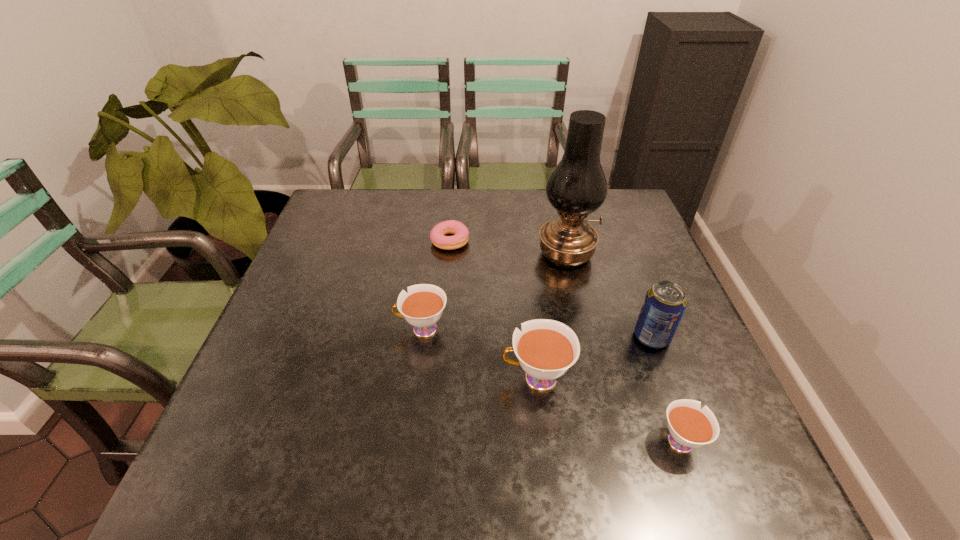
This screenshot has width=960, height=540. I want to click on unoccupied area between the oil lamp and the doughnut, so click(508, 247).

Where is `unoccupied area between the doughnut and the fourth tallest object`? unoccupied area between the doughnut and the fourth tallest object is located at coordinates (436, 285).

This screenshot has width=960, height=540. Find the location of `vacant point located between the fourth tallest object and the tallest object`. vacant point located between the fourth tallest object and the tallest object is located at coordinates (493, 292).

You are a GUI agent. You are given a task and a screenshot of the screen. Output one action in this format:
    pyautogui.click(x=<x>, y=<y>)
    Task: Click on the free point between the nearest object and the second tallest object
    
    Given the screenshot: What is the action you would take?
    pyautogui.click(x=665, y=388)

Locate an element on the screen. This screenshot has width=960, height=540. vacant point located between the doughnut and the oil lamp is located at coordinates (508, 247).

Identify the location of empty space between the soda and the shortest teacup. The height and width of the screenshot is (540, 960). (665, 388).

Where is `blank region between the leftmost teacup and the oil lamp`? This screenshot has height=540, width=960. blank region between the leftmost teacup and the oil lamp is located at coordinates (493, 292).

The height and width of the screenshot is (540, 960). Identify the location of free spot between the second farthest teacup and the shortest object. (493, 309).

Locate which object ranks fourth in proximity to the rightmost teacup. Please provide its 2D coordinates. Your answer should be formatted as a tuple, i.e. [(x, y)], where the tuple contains the x and y coordinates of a point satisfying the conditions above.

[(422, 307)]

Locate which object is the closest to the shortest teacup. Please provide its 2D coordinates. Your answer should be formatted as a tuple, i.e. [(x, y)], where the tuple contains the x and y coordinates of a point satisfying the conditions above.

[(546, 349)]